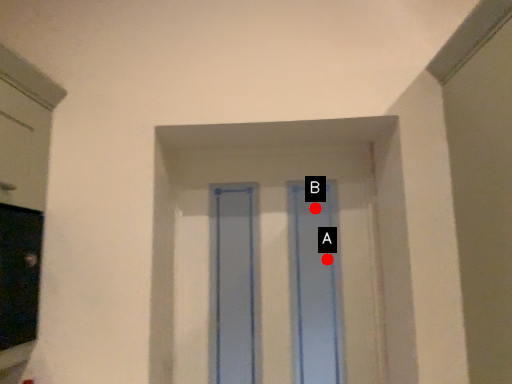
Question: Two points are circled on the image, labeled by A and B beside each circle. Among these points, which one is nearest to the camera?

Choices:
 (A) A is closer
 (B) B is closer

Answer: (A)